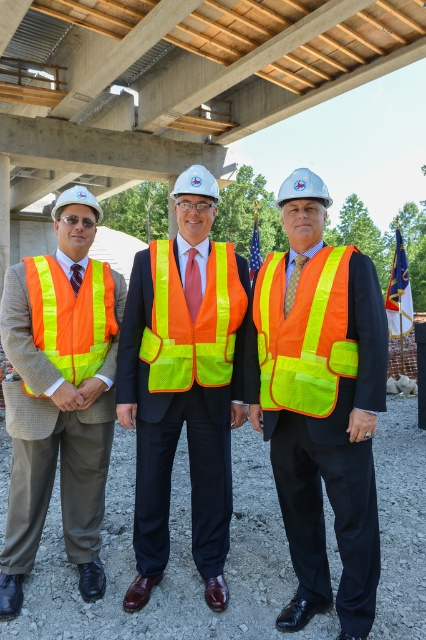
Question: Which point is closer to the camera?

Choices:
 (A) (43, 403)
 (B) (221, 552)

Answer: (A)

Question: From the image, what is the correct spatial relationship of high-visibility reflective vest at center in relation to high-visibility reflective safety vest at center?

Choices:
 (A) left
 (B) right

Answer: (A)

Question: Which object appears farthest from the camera in this image?

Choices:
 (A) high visibility reflective vest at center
 (B) high-visibility reflective vest at center
 (C) neon yellow reflective safety vest at center

Answer: (B)

Question: Where is high visibility reflective vest at center located in relation to high-visibility reflective vest at center in the image?

Choices:
 (A) left
 (B) right

Answer: (B)

Question: Which point is farther to the camera?

Choices:
 (A) matte orange safety vest at center
 (B) high-visibility reflective safety vest at center

Answer: (B)

Question: Is high-visibility reflective safety vest at center smaller than high-visibility reflective safety vest at left?

Choices:
 (A) yes
 (B) no

Answer: (A)